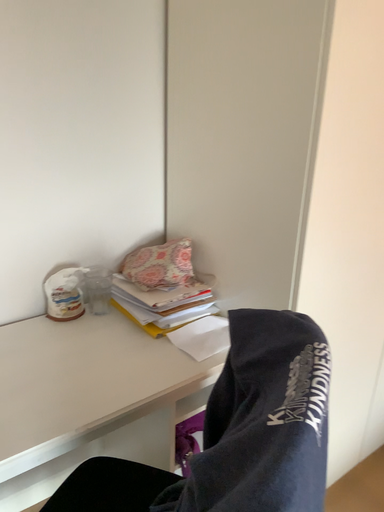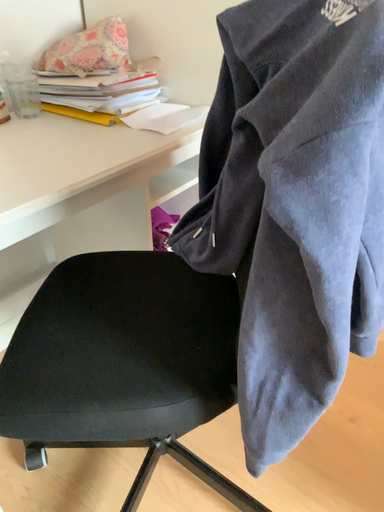
Question: How did the camera likely rotate when shooting the video?

Choices:
 (A) rotated right
 (B) rotated left

Answer: (A)